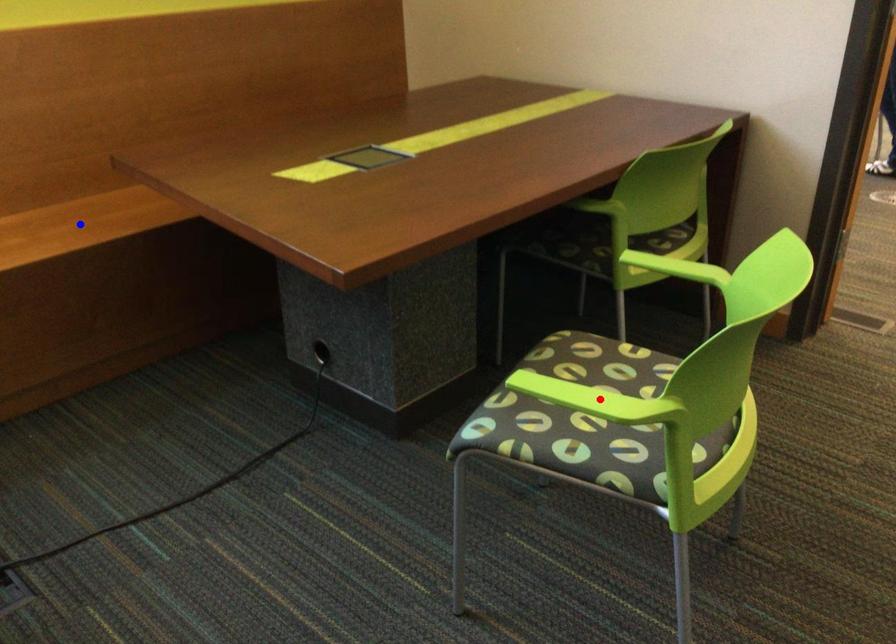
Question: Two points are marked on the image. Which point is closer to the camera?

Choices:
 (A) Blue point is closer.
 (B) Red point is closer.

Answer: (B)